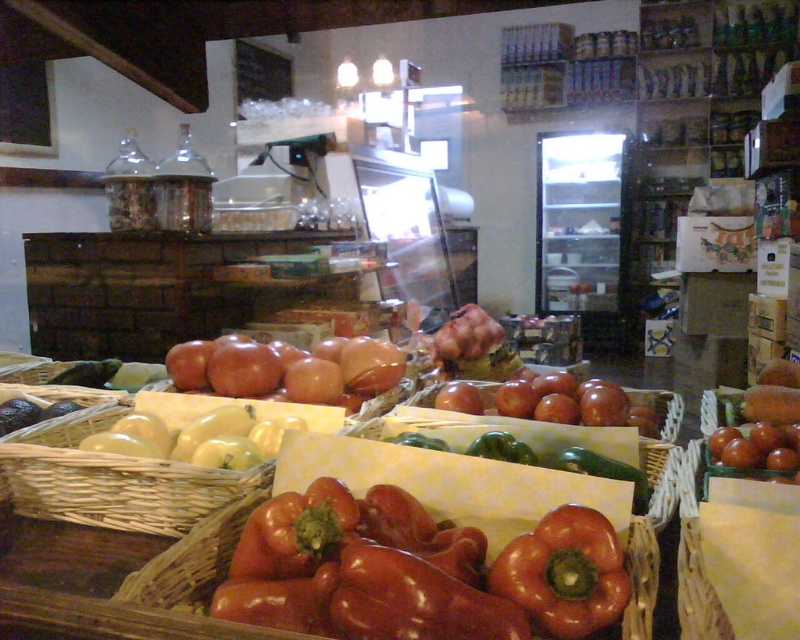
Does shiny red bell pepper at lower center appear under matte brown apples at center?

Yes, shiny red bell pepper at lower center is below matte brown apples at center.

Which of these two, shiny red bell pepper at lower center or matte brown apples at center, stands shorter?

Standing shorter between the two is matte brown apples at center.

Does point (617, 616) come in front of point (632, 392)?

That is True.

The width and height of the screenshot is (800, 640). I want to click on shiny red bell pepper at lower center, so click(564, 573).

Between green matte apples at lower left and matte brown apples at center, which one appears on the right side from the viewer's perspective?

matte brown apples at center is more to the right.

Identify the location of green matte apples at lower left. The image size is (800, 640). (197, 438).

Which of these two, shiny red bell pepper at lower center or green matte apples at lower left, stands taller?

With more height is shiny red bell pepper at lower center.

What do you see at coordinates (564, 573) in the screenshot? This screenshot has width=800, height=640. I see `shiny red bell pepper at lower center` at bounding box center [564, 573].

The width and height of the screenshot is (800, 640). Find the location of `shiny red bell pepper at lower center`. shiny red bell pepper at lower center is located at coordinates (564, 573).